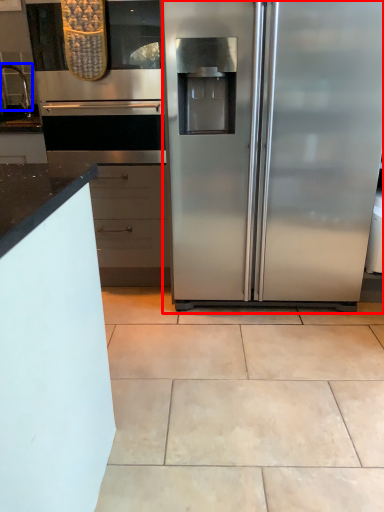
Question: Which of the following is the closest to the observer, refrigerator (highlighted by a red box) or faucet (highlighted by a blue box)?

Choices:
 (A) refrigerator
 (B) faucet

Answer: (A)